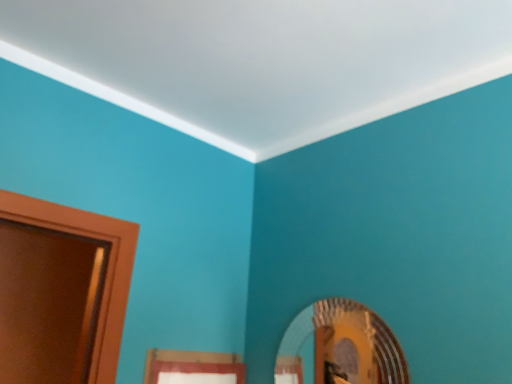
Question: Should I look upward or downward to see gold textured mirror at lower right?

Choices:
 (A) up
 (B) down

Answer: (B)